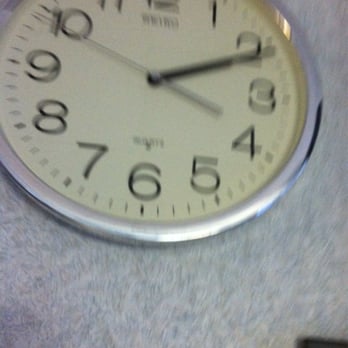
You are a GUI agent. You are given a task and a screenshot of the screen. Output one action in this format:
    pyautogui.click(x=<x>, y=<y>)
    Task: Click on the blurry clock frame
    This screenshot has width=348, height=348.
    Given the screenshot: What is the action you would take?
    pyautogui.click(x=296, y=39), pyautogui.click(x=318, y=88), pyautogui.click(x=286, y=178), pyautogui.click(x=174, y=239), pyautogui.click(x=28, y=191), pyautogui.click(x=2, y=137), pyautogui.click(x=145, y=224), pyautogui.click(x=234, y=207)